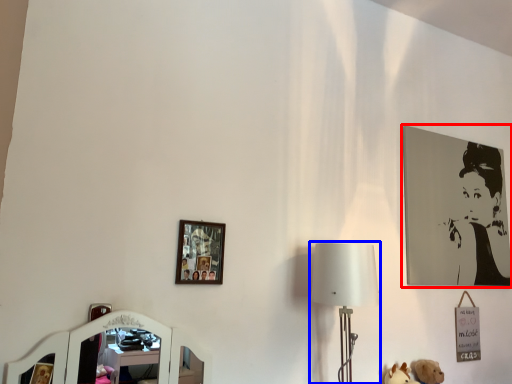
Question: Which object is further to the camera taking this photo, picture frame (highlighted by a red box) or table lamp (highlighted by a blue box)?

Choices:
 (A) picture frame
 (B) table lamp

Answer: (A)